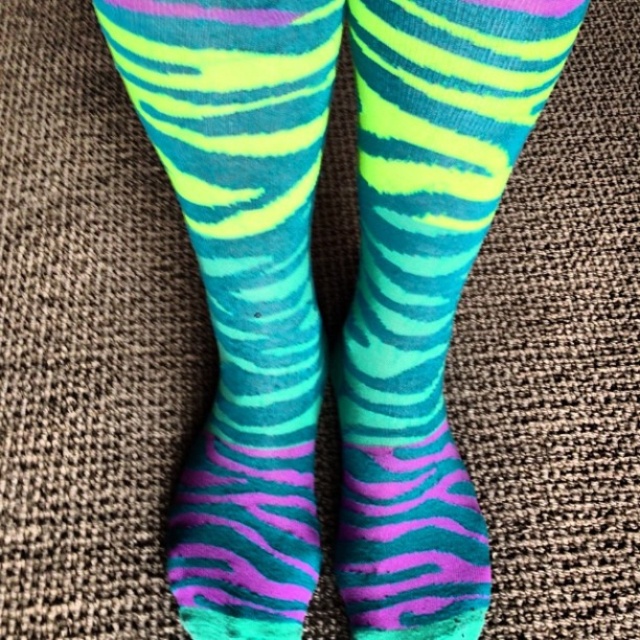
Can you confirm if neon zebra socks at center is thinner than neon zebra-patterned socks at center?

Incorrect, neon zebra socks at center's width is not less than neon zebra-patterned socks at center's.

Is point (268, 499) positioned before point (500, 147)?

No.

Where is `neon zebra socks at center`? This screenshot has width=640, height=640. neon zebra socks at center is located at coordinates (243, 285).